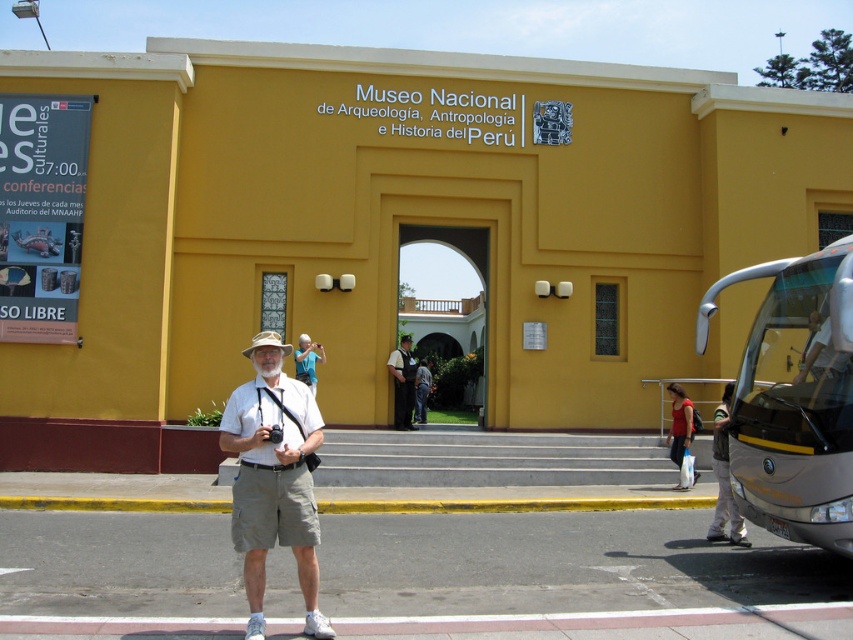
Which is more to the right, khaki cotton shorts at center or blue fabric shirt at center?

From the viewer's perspective, khaki cotton shorts at center appears more on the right side.

Does khaki cotton shorts at center have a larger size compared to blue fabric shirt at center?

Yes.

Measure the distance between point (270, 376) and camera.

They are 5.55 meters apart.

At what (x,y) coordinates should I click in order to perform the action: click on khaki cotton shorts at center. Please return your answer as a coordinate pair (x, y). This screenshot has height=640, width=853. Looking at the image, I should click on (273, 477).

The width and height of the screenshot is (853, 640). I want to click on khaki cotton shorts at center, so click(273, 477).

Between khaki cotton shorts at center and dark blue uniform at center, which one appears on the left side from the viewer's perspective?

khaki cotton shorts at center

Is point (247, 435) less distant than point (403, 419)?

Yes.

Identify the location of khaki cotton shorts at center. (273, 477).

Between silver metallic bus at right and denim pants at lower right, which one is positioned lower?

Positioned lower is denim pants at lower right.

Can you confirm if silver metallic bus at right is smaller than denim pants at lower right?

No.

I want to click on silver metallic bus at right, so click(x=793, y=397).